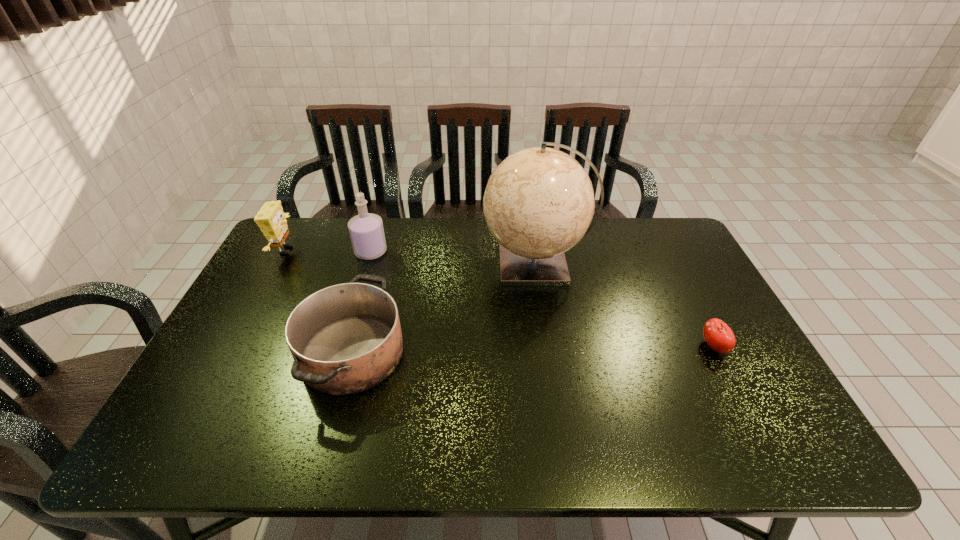
At what (x,y) coordinates should I click in order to perform the action: click on object located in the far left corner section of the desktop. Please return your answer as a coordinate pair (x, y). The width and height of the screenshot is (960, 540). Looking at the image, I should click on (271, 219).

I want to click on blank space at the far edge of the desktop, so click(x=415, y=225).

The width and height of the screenshot is (960, 540). Find the location of `blank area at the near edge`. blank area at the near edge is located at coordinates (288, 438).

Find the location of a particular element. vacant space at the left edge of the desktop is located at coordinates (267, 367).

The width and height of the screenshot is (960, 540). In the image, there is a desktop. Identify the location of vacant region at the right edge. (685, 350).

What are the coordinates of `free space at the far left corner of the desktop` in the screenshot? It's located at (300, 238).

Locate an element on the screen. This screenshot has width=960, height=540. vacant region between the second tallest object and the third tallest object is located at coordinates (328, 251).

You are a GUI agent. You are given a task and a screenshot of the screen. Output one action in this format:
    pyautogui.click(x=<x>, y=<y>)
    Task: Click on the vacant area that lies between the second tallest object and the leftmost object
    Image resolution: width=960 pixels, height=540 pixels.
    Given the screenshot: What is the action you would take?
    pyautogui.click(x=328, y=251)

The image size is (960, 540). Find the location of `free space between the perfume and the leftmost object`. free space between the perfume and the leftmost object is located at coordinates (328, 251).

Image resolution: width=960 pixels, height=540 pixels. Identify the location of free spot between the saucepan and the apple. (533, 350).